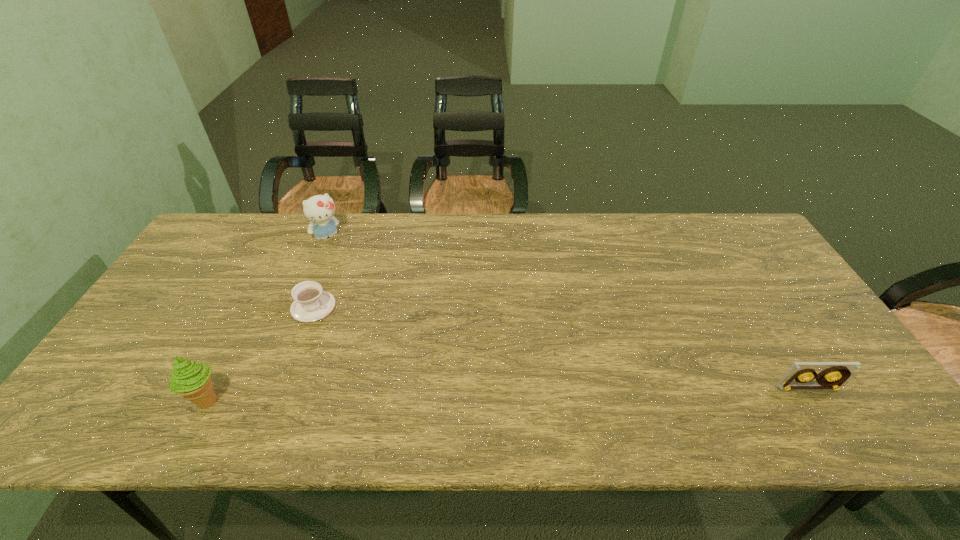
The image size is (960, 540). I want to click on the leftmost object, so [x=192, y=380].

Find the location of a particular element. the second shortest object is located at coordinates (833, 374).

This screenshot has width=960, height=540. Find the location of `videotape`. videotape is located at coordinates (833, 374).

Image resolution: width=960 pixels, height=540 pixels. I want to click on teacup, so click(311, 303).

The image size is (960, 540). Find the location of `the second farthest object`. the second farthest object is located at coordinates (311, 303).

Image resolution: width=960 pixels, height=540 pixels. Identify the location of the farthest object. (319, 209).

Identify the location of free space located on the left of the leftmost object. The width and height of the screenshot is (960, 540). (150, 401).

Find the location of a particular element. The image size is (960, 540). free space located 0.350m on the handle side of the shortest object is located at coordinates (430, 376).

Where is `vacant region located 0.340m on the handle side of the shortest object`? This screenshot has width=960, height=540. vacant region located 0.340m on the handle side of the shortest object is located at coordinates (426, 374).

The image size is (960, 540). In order to click on free spot located 0.220m on the handle side of the shortest object in this screenshot , I will do `click(389, 352)`.